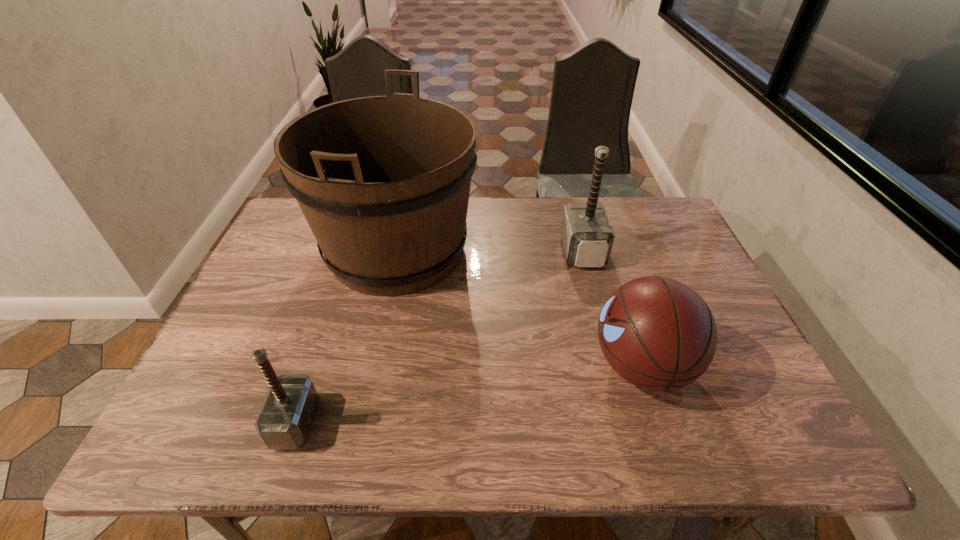
Locate an element on the screen. The width and height of the screenshot is (960, 540). vacant area that lies between the left hammer and the second tallest object is located at coordinates (439, 337).

Identify the location of vacant region between the basketball and the tallest object. This screenshot has height=540, width=960. (519, 308).

Find the location of `vacant area that lies between the tallest object and the nearer hammer`. vacant area that lies between the tallest object and the nearer hammer is located at coordinates (346, 336).

Find the location of a particular element. The image size is (960, 540). empty space that is in between the bucket and the taller hammer is located at coordinates (490, 250).

You are a GUI agent. You are given a task and a screenshot of the screen. Output one action in this format:
    pyautogui.click(x=<x>, y=<y>)
    Task: Click on the free space between the tallest object and the nearer hammer
    The width and height of the screenshot is (960, 540).
    Given the screenshot: What is the action you would take?
    pyautogui.click(x=346, y=336)

Identify the location of the third closest object to the nearer hammer. (587, 236).

The height and width of the screenshot is (540, 960). I want to click on the closest object to the basketball, so click(x=587, y=236).

Identify the location of free space that satisfies the following two spatial constraints: 1. for striking with the head of the second tallest object; 2. on the left side of the basketball. (612, 366).

I want to click on free point that satisfies the following two spatial constraints: 1. for striking with the head of the farther hammer; 2. on the right side of the basketball, so click(x=612, y=366).

The height and width of the screenshot is (540, 960). I want to click on vacant region that satisfies the following two spatial constraints: 1. for striking with the head of the third shortest object; 2. on the back side of the basketball, so click(612, 366).